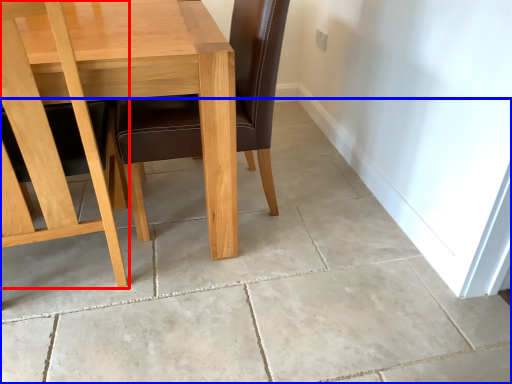
Question: Which object appears farthest to the camera in this image, chair (highlighted by a red box) or concrete (highlighted by a blue box)?

Choices:
 (A) chair
 (B) concrete

Answer: (B)